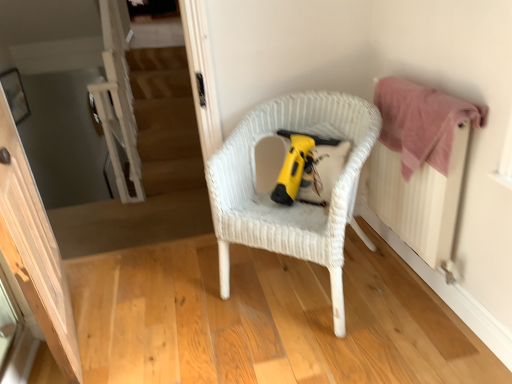
At what (x,y) coordinates should I click in order to perform the action: click on vacant space to the left of white wicker chair at center. Please return your answer as a coordinate pair (x, y). Image resolution: width=512 pixels, height=384 pixels. Looking at the image, I should click on (178, 308).